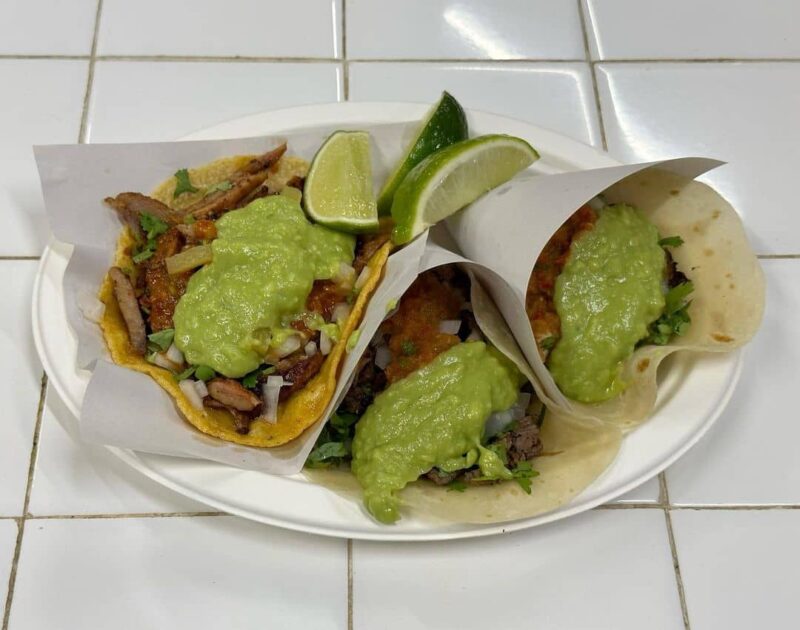
This screenshot has height=630, width=800. I want to click on plate, so click(x=241, y=510).